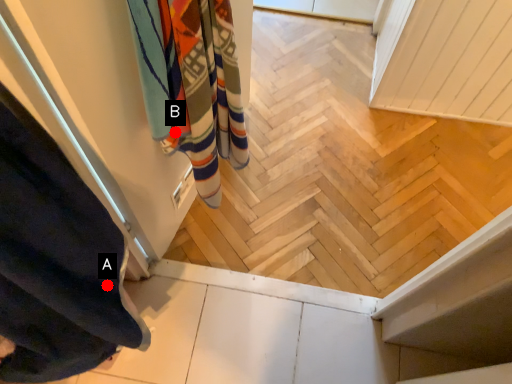
Question: Two points are circled on the image, labeled by A and B beside each circle. Which point is further to the camera?

Choices:
 (A) A is further
 (B) B is further

Answer: (B)